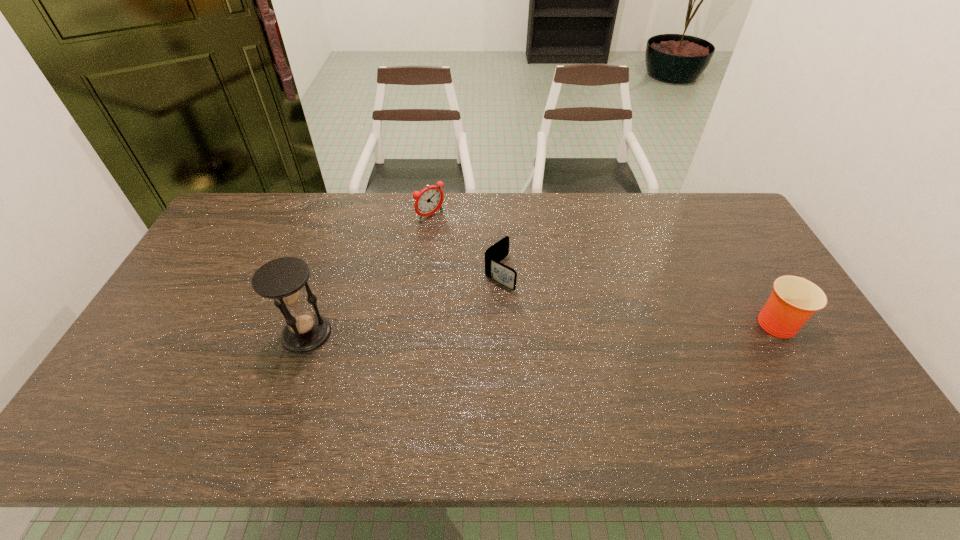
Where is `free region located on the outer surface of the second farthest object`? free region located on the outer surface of the second farthest object is located at coordinates (589, 332).

At what (x,y) coordinates should I click in order to perform the action: click on free space located 0.310m on the outer surface of the second farthest object. Please return your answer as a coordinate pair (x, y). Looking at the image, I should click on (603, 340).

I want to click on blank space located on the front-facing side of the alarm clock, so click(482, 258).

Where is `free region located 0.320m on the front-facing side of the alarm clock`? The height and width of the screenshot is (540, 960). free region located 0.320m on the front-facing side of the alarm clock is located at coordinates (498, 272).

Find the location of a particular element. Image resolution: width=960 pixels, height=540 pixels. vacant region located 0.170m on the front-facing side of the alarm clock is located at coordinates (468, 247).

Identify the location of object located in the far edge section of the desktop. This screenshot has height=540, width=960. (428, 201).

What are the coordinates of `object positioned at the right edge` in the screenshot? It's located at click(794, 300).

In the image, there is a desktop. At what (x,y) coordinates should I click in order to perform the action: click on vacant space at the far edge. Please return your answer as a coordinate pair (x, y). Looking at the image, I should click on (584, 230).

At what (x,y) coordinates should I click in order to perform the action: click on free space at the near edge. Please return your answer as a coordinate pair (x, y). Image resolution: width=960 pixels, height=540 pixels. Looking at the image, I should click on (583, 402).

What are the coordinates of `vacant space at the left edge of the desktop` in the screenshot? It's located at (178, 343).